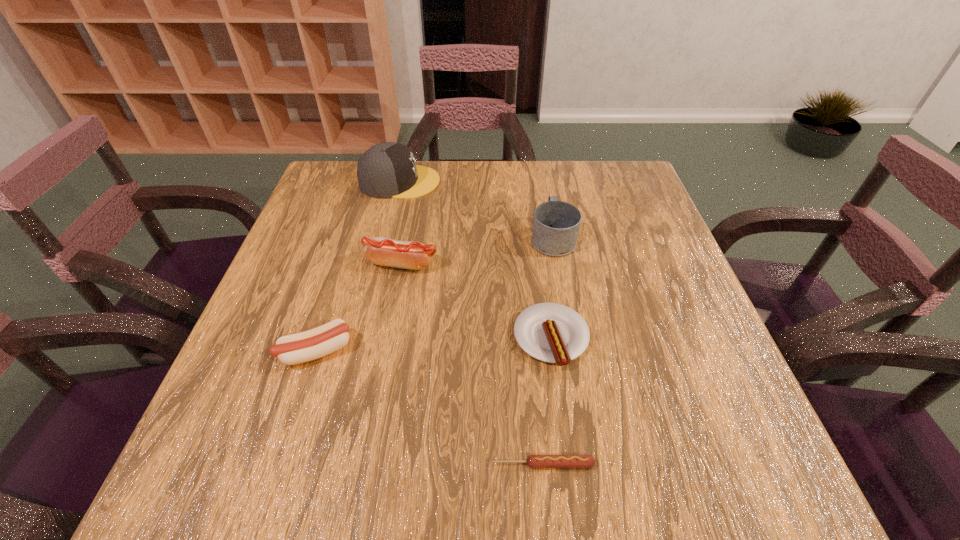
Identify the location of cap. This screenshot has width=960, height=540. (386, 170).

In order to click on the tallest object in this screenshot , I will do `click(386, 170)`.

You are a GUI agent. You are given a task and a screenshot of the screen. Output one action in this format:
    pyautogui.click(x=<x>, y=<y>)
    Task: Click on the mug
    
    Given the screenshot: What is the action you would take?
    pos(556,224)

Find the location of `the farthest sausage`. the farthest sausage is located at coordinates (382, 251).

Identify the location of the third tallest object. This screenshot has width=960, height=540. [382, 251].

The height and width of the screenshot is (540, 960). Identify the location of the third shortest sausage. (309, 345).

Identify the location of the second shortest object. The height and width of the screenshot is (540, 960). (550, 332).

At what (x,y) coordinates should I click in order to perform the action: click on the nearest object. Please return your answer as a coordinate pair (x, y). The image size is (960, 540). Looking at the image, I should click on (533, 461).

Identify the location of the nearest sausage. (533, 461).

Find the location of a particular element. This screenshot has width=960, height=540. free space located 0.060m on the front-facing side of the cap is located at coordinates (461, 181).